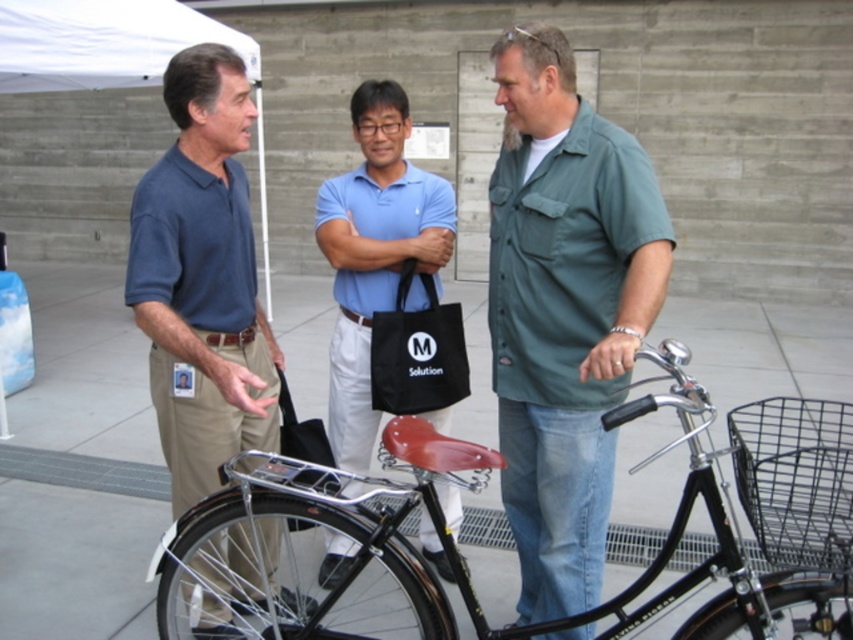
Who is lower down, shiny black bicycle at center or matte blue shirt at left?

shiny black bicycle at center is below.

Between shiny black bicycle at center and matte blue shirt at left, which one is positioned higher?

Positioned higher is matte blue shirt at left.

Locate an element on the screen. This screenshot has height=640, width=853. shiny black bicycle at center is located at coordinates (303, 545).

At what (x,y) coordinates should I click in order to perform the action: click on shiny black bicycle at center. Please return your answer as a coordinate pair (x, y). Looking at the image, I should click on (303, 545).

Based on the photo, is blue cotton polo shirt at center shorter than white fabric canopy at upper left?

No.

Is point (451, 579) less distant than point (215, 26)?

Yes, point (451, 579) is closer to viewer.

The height and width of the screenshot is (640, 853). Describe the element at coordinates (375, 253) in the screenshot. I see `blue cotton polo shirt at center` at that location.

Image resolution: width=853 pixels, height=640 pixels. I want to click on blue cotton polo shirt at center, so click(375, 253).

Who is taller, green cotton shirt at center or matte blue shirt at left?

matte blue shirt at left

Who is positioned more to the right, green cotton shirt at center or matte blue shirt at left?

green cotton shirt at center

Does point (566, 420) come behind point (218, 244)?

No, it is in front of (218, 244).

Where is `green cotton shirt at center`? The image size is (853, 640). green cotton shirt at center is located at coordinates (564, 310).